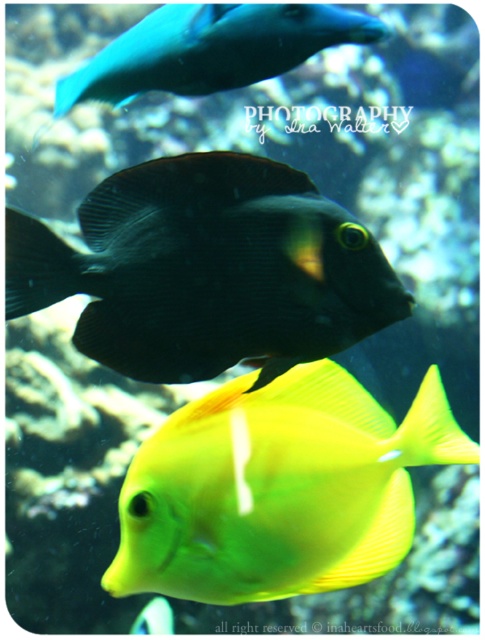
Question: Which object appears farthest from the camera in this image?

Choices:
 (A) matte black fish at center
 (B) shiny blue fish at upper center

Answer: (B)

Question: From the image, what is the correct spatial relationship of matte black fish at center in relation to yellow matte fish at center?

Choices:
 (A) left
 (B) right

Answer: (A)

Question: Is matte black fish at center thinner than shiny blue fish at upper center?

Choices:
 (A) no
 (B) yes

Answer: (B)

Question: Which point is farther from the camera taking this photo?

Choices:
 (A) [339, 442]
 (B) [141, 68]
 (C) [368, 332]

Answer: (B)

Question: Which of the following is the closest to the observer?

Choices:
 (A) matte black fish at center
 (B) shiny blue fish at upper center

Answer: (A)

Question: Is matte black fish at center bigger than shiny blue fish at upper center?

Choices:
 (A) no
 (B) yes

Answer: (A)